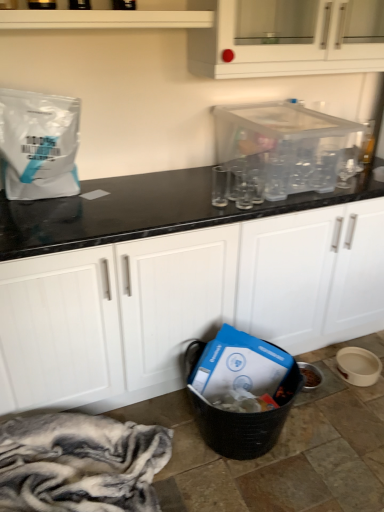
You are a GUI agent. You are given a task and a screenshot of the screen. Output one action in this format:
    pyautogui.click(x=<x>, y=<y>)
    Task: Click on the vacant area that is in front of white matte paper bag at upper left
    The width and height of the screenshot is (384, 512).
    Given the screenshot: What is the action you would take?
    pos(46,216)